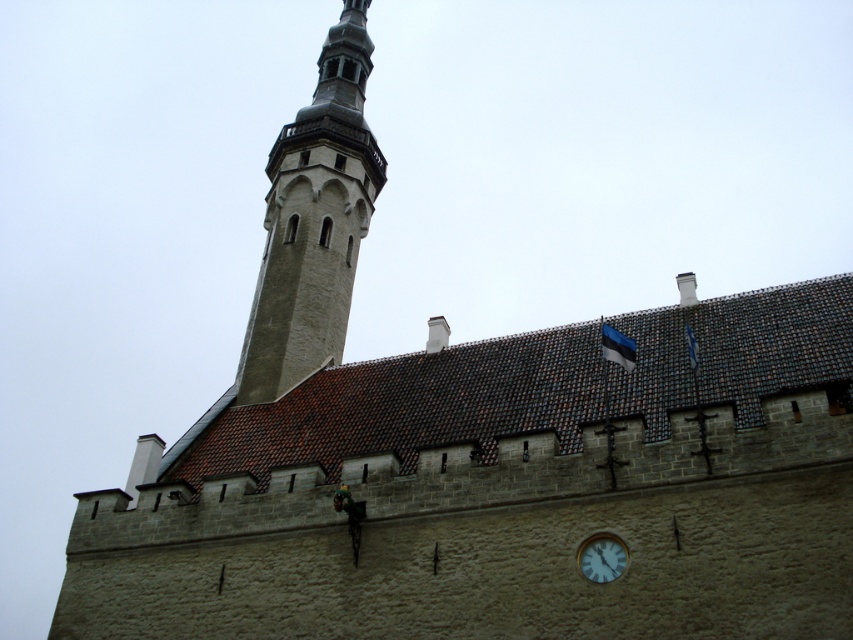
Question: Does smooth stone tower at upper left appear on the right side of white plastic clock at lower right?

Choices:
 (A) no
 (B) yes

Answer: (A)

Question: In this image, where is smooth stone tower at upper left located relative to white plastic clock at lower right?

Choices:
 (A) below
 (B) above

Answer: (B)

Question: Can you confirm if smooth stone tower at upper left is positioned above white plastic clock at lower right?

Choices:
 (A) yes
 (B) no

Answer: (A)

Question: Which point is closer to the camera?

Choices:
 (A) pos(276,387)
 (B) pos(601,554)

Answer: (B)

Question: Among these objects, which one is farthest from the camera?

Choices:
 (A) white plastic clock at lower right
 (B) smooth stone tower at upper left

Answer: (B)